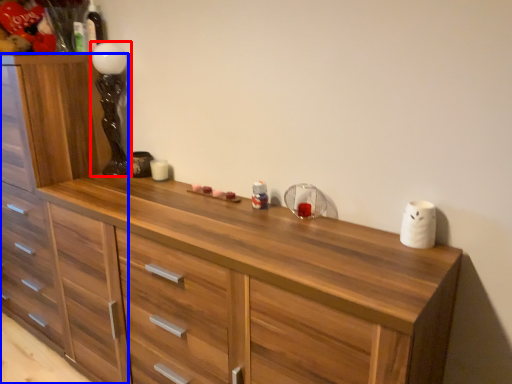
Question: Which of the following is the farthest to the observer, lamp (highlighted by a red box) or chest of drawers (highlighted by a blue box)?

Choices:
 (A) lamp
 (B) chest of drawers

Answer: (A)